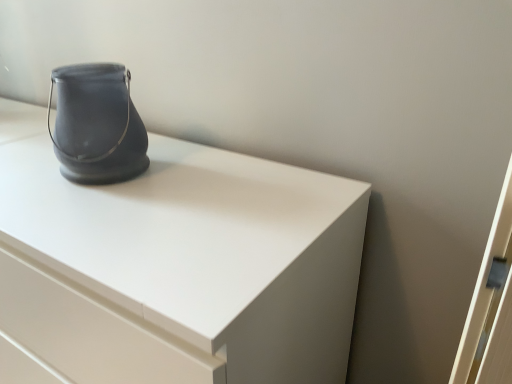
Consider the image. Measure the distance between matte black vase at upper left and camera.

The distance of matte black vase at upper left from camera is 72.90 centimeters.

Measure the distance between point (x=64, y=154) and camera.

The distance of point (x=64, y=154) from camera is 30.12 inches.

You are a GUI agent. You are given a task and a screenshot of the screen. Output one action in this format:
    pyautogui.click(x=<x>, y=<y>)
    Task: Click on the matte black vase at upper left
    Image resolution: width=512 pixels, height=384 pixels.
    Given the screenshot: What is the action you would take?
    pyautogui.click(x=97, y=124)

Image resolution: width=512 pixels, height=384 pixels. Describe the element at coordinates (97, 124) in the screenshot. I see `matte black vase at upper left` at that location.

This screenshot has width=512, height=384. I want to click on matte black vase at upper left, so click(x=97, y=124).